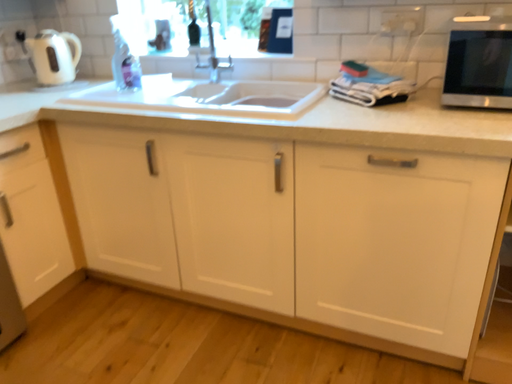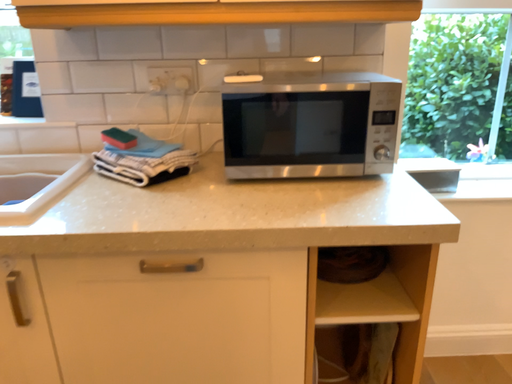
Question: How did the camera likely rotate when shooting the video?

Choices:
 (A) rotated downward
 (B) rotated upward

Answer: (B)